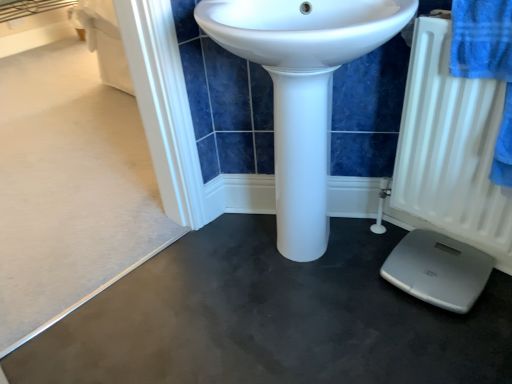
Identify the location of space that is in front of white glossy sink at center. (329, 338).